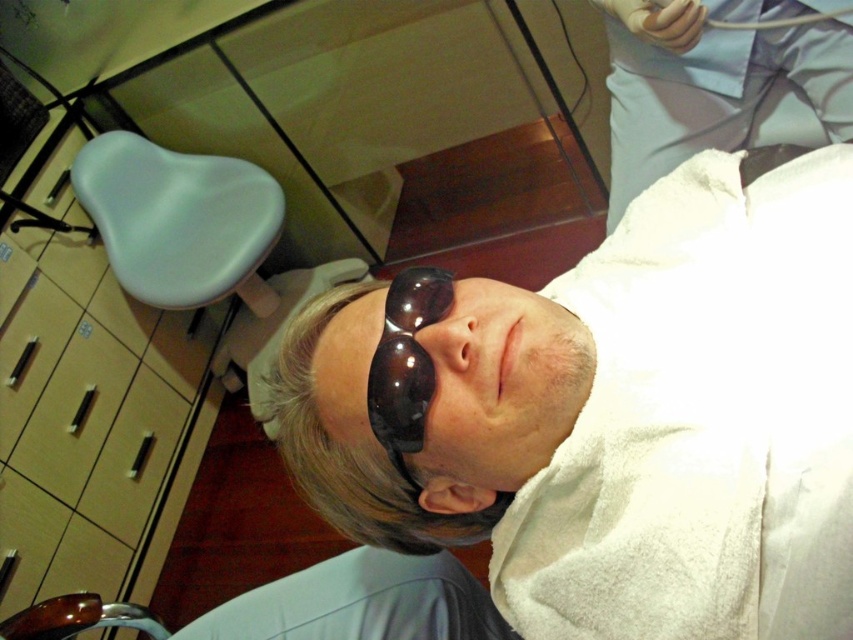
Is light blue plastic chair at left taller than dark matte glasses at center?

Yes, light blue plastic chair at left is taller than dark matte glasses at center.

You are a GUI agent. You are given a task and a screenshot of the screen. Output one action in this format:
    pyautogui.click(x=<x>, y=<y>)
    Task: Click on the light blue plastic chair at left
    Image resolution: width=853 pixels, height=640 pixels.
    Given the screenshot: What is the action you would take?
    pyautogui.click(x=177, y=218)

You are a GUI agent. You are given a task and a screenshot of the screen. Output one action in this format:
    pyautogui.click(x=<x>, y=<y>)
    Task: Click on the light blue plastic chair at left
    The image size is (853, 640).
    Given the screenshot: What is the action you would take?
    pyautogui.click(x=177, y=218)

Does white cloth at upper right have a greater width compared to dark matte glasses at center?

Yes, white cloth at upper right is wider than dark matte glasses at center.

Is white cloth at upper right bigger than dark matte glasses at center?

Indeed, white cloth at upper right has a larger size compared to dark matte glasses at center.

Who is more forward, [605,22] or [422,394]?

Point [422,394]

Image resolution: width=853 pixels, height=640 pixels. In order to click on white cloth at upper right in this screenshot , I will do `click(718, 83)`.

Is white cloth at upper right positioned at the back of light blue plastic chair at left?

That is False.

I want to click on white cloth at upper right, so click(718, 83).

Image resolution: width=853 pixels, height=640 pixels. I want to click on white cloth at upper right, so click(718, 83).